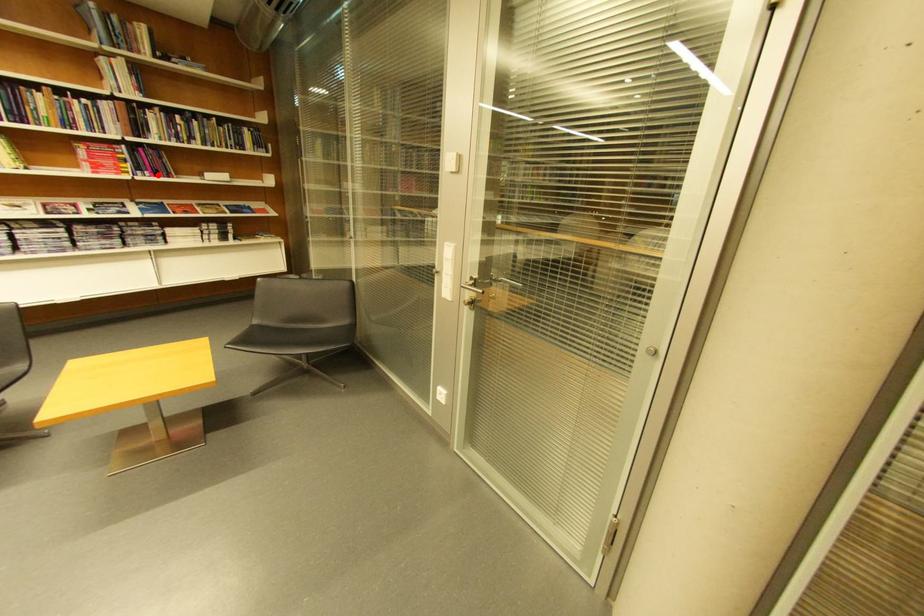
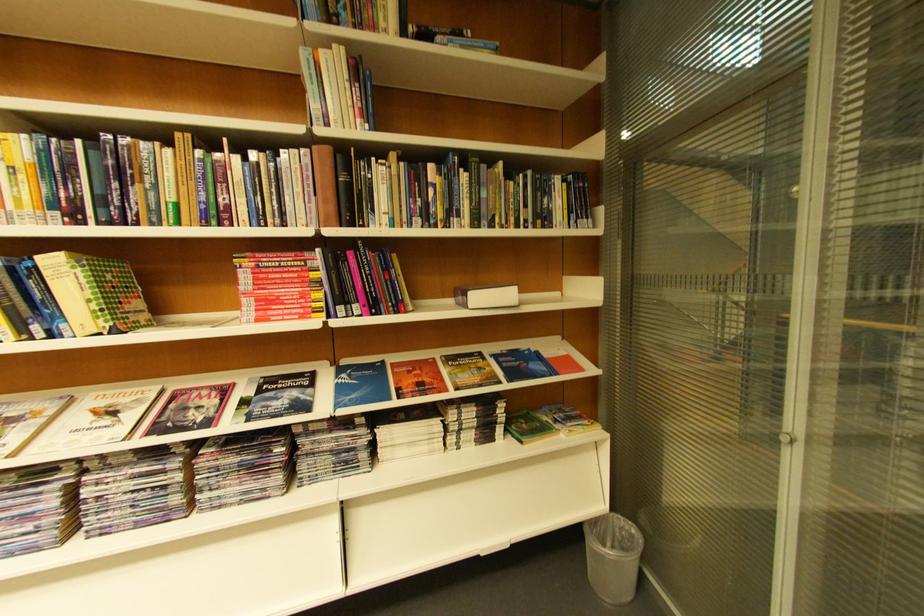
Locate, in the second image, the point that corresponds to the highlighted location in the first image.

(367, 310)